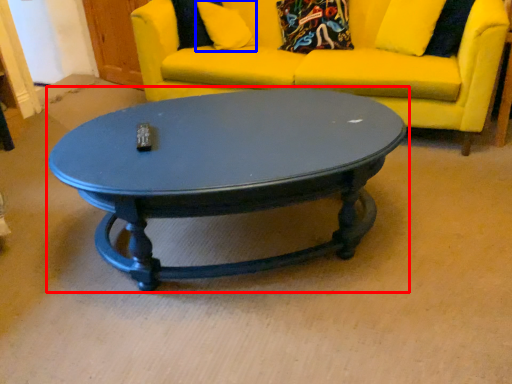
Question: Which point is further to the camera, coffee table (highlighted by a red box) or pillow (highlighted by a blue box)?

Choices:
 (A) coffee table
 (B) pillow

Answer: (B)